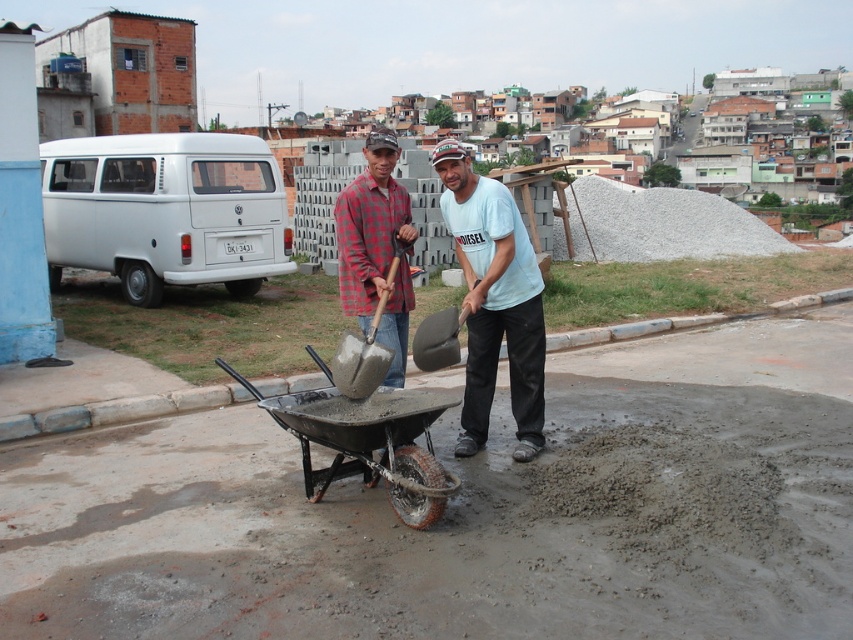
You are a construction worker standing at the point marked as point (334, 384). You need to move to the point marked as point (425, 480). Which direction should you move relative to your current position?

You should move towards the point (425, 480), which is closer to the camera than your current position at point (334, 384). Since the point (425, 480) is closer to the camera, you should move forward in the direction towards the camera to reach it.

You are a construction worker who needs to choose between the matte concrete shovel at center and the metallic gray wheelbarrow at center for a task that requires a wider tool. Which one should you select?

The matte concrete shovel at center has a larger width than the metallic gray wheelbarrow at center, so you should select the matte concrete shovel at center for the task requiring a wider tool.

You are a construction worker who needs to locate your matte concrete shovel at center. Based on the coordinates provided, can you determine its exact position in the image?

The matte concrete shovel at center is located at the 2D coordinates point (494, 301).